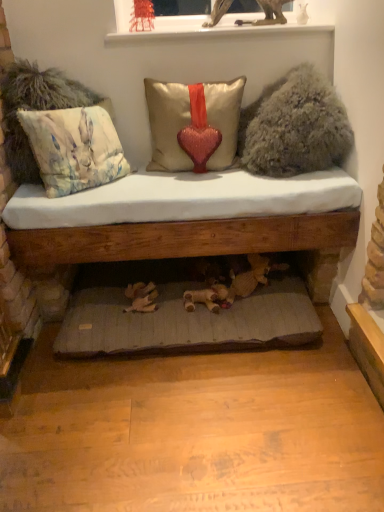
Question: Is point (228, 137) closer or farther from the camera than point (319, 82)?

Choices:
 (A) closer
 (B) farther

Answer: (B)

Question: From the image's perspective, is satin/velvet pillow with heart at center, which appears as the second pillow when viewed from the left, positioned above or below fuzzy beige pillow at upper right?

Choices:
 (A) below
 (B) above

Answer: (A)

Question: Which of these objects is positioned farthest from the pastel floral fabric cushion at left, acting as the second pillow starting from the right?

Choices:
 (A) satin/velvet pillow with heart at center, which appears as the second pillow when viewed from the left
 (B) white glossy window sill at upper center
 (C) gray fabric cushion at lower center
 (D) wooden cushioned bench at center
 (E) fuzzy beige pillow at upper right

Answer: (C)

Question: Based on their relative distances, which object is farther from the wooden cushioned bench at center?

Choices:
 (A) satin/velvet pillow with heart at center, which is the first pillow in right-to-left order
 (B) gray fabric cushion at lower center
 (C) fuzzy beige pillow at upper right
 (D) wooden bed frame at lower center
 (E) white glossy window sill at upper center

Answer: (E)